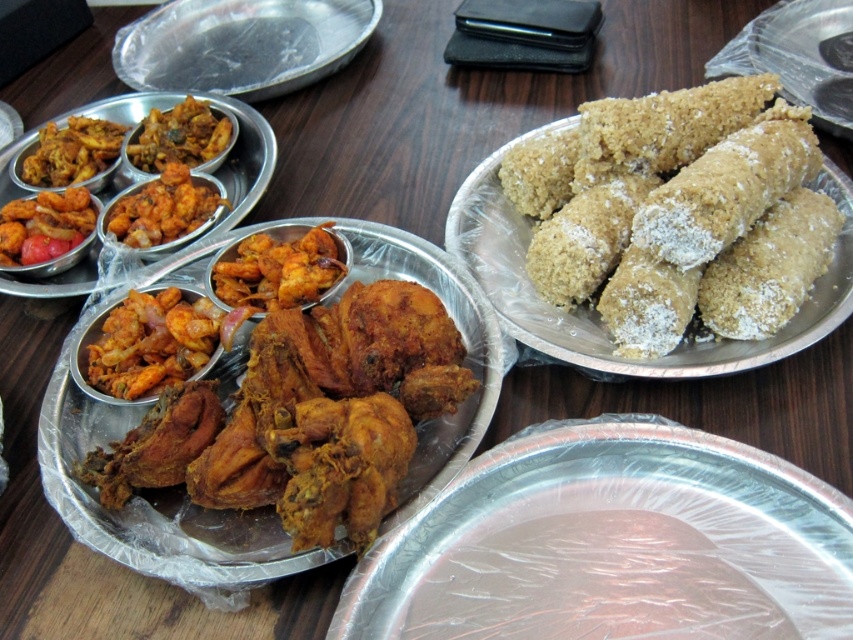
Question: Which point is farther to the camera?

Choices:
 (A) matte orange curry at center
 (B) shiny aluminum tray at center
 (C) brown matte curry at upper left
 (D) silver metallic tray at upper left

Answer: (D)

Question: Which point is closer to the camera?

Choices:
 (A) (341, 364)
 (B) (747, 273)
 (C) (177, 209)

Answer: (A)

Question: Which of the following is the closest to the observer?

Choices:
 (A) click(142, 246)
 (B) click(672, 221)

Answer: (B)

Question: Is powdery brown pastry at right positioned in front of shiny metallic tray at upper left?

Choices:
 (A) no
 (B) yes

Answer: (B)

Question: Can you confirm if shiny red tomato at upper left is positioned to the right of matte brown curry at upper left?

Choices:
 (A) no
 (B) yes

Answer: (B)

Question: Is golden crispy fried shrimp at center to the left of shiny red tomato at upper left from the viewer's perspective?

Choices:
 (A) yes
 (B) no

Answer: (B)